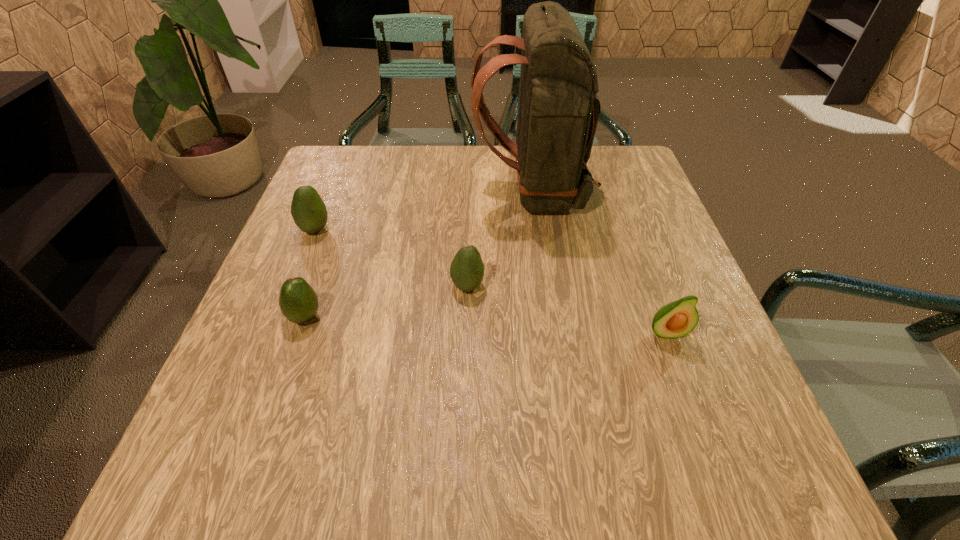
At what (x,y) coordinates should I click in order to perform the action: click on vacant point located on the right of the third nearest avocado. Please return your answer as a coordinate pair (x, y). Looking at the image, I should click on (645, 286).

At what (x,y) coordinates should I click in order to perform the action: click on object that is positioned at the far edge. Please return your answer as a coordinate pair (x, y). The image size is (960, 540). Looking at the image, I should click on (558, 109).

You are a GUI agent. You are given a task and a screenshot of the screen. Output one action in this format:
    pyautogui.click(x=<x>, y=<y>)
    Task: Click on the backpack that is at the right edge
    This screenshot has width=960, height=540.
    Given the screenshot: What is the action you would take?
    pyautogui.click(x=558, y=109)

Where is `avocado positioned at the right edge`? The height and width of the screenshot is (540, 960). avocado positioned at the right edge is located at coordinates (677, 319).

Where is `object at the far right corner`? object at the far right corner is located at coordinates (558, 109).

I want to click on vacant space at the far edge, so click(380, 172).

Identify the location of free space at the near edge. Image resolution: width=960 pixels, height=540 pixels. (467, 488).

The image size is (960, 540). In the image, there is a desktop. Identify the location of free space at the left edge. (309, 268).

I want to click on vacant space at the right edge, so click(681, 255).

At what (x,y) coordinates should I click in order to perform the action: click on vacant space at the far left corner of the desktop. Please return your answer as a coordinate pair (x, y). Looking at the image, I should click on (343, 179).